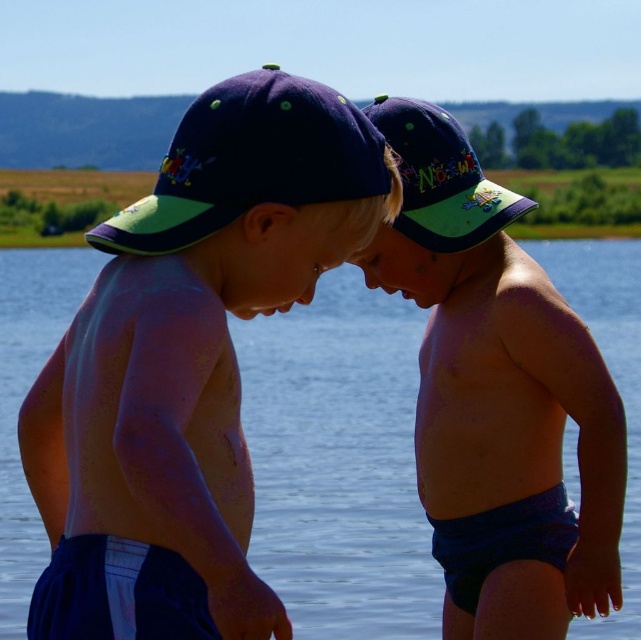
You are a photographer trying to capture the children in the scene. You need to ensure that both the transparent blue water at center and the matte blue shorts at center are visible in your shot. Given their sizes, which object should you focus on to include both in the frame?

Since the transparent blue water at center is larger than the matte blue shorts at center, you should focus on the transparent blue water at center to ensure both objects fit within the frame.

Looking at this image, you are a lifeguard on duty at the lake. You notice two children near the water. One has matte blue shorts at center and the other is near transparent blue water at center. Which child is closer to the water?

The child with matte blue shorts at center is closer to the transparent blue water at center because the water is below the shorts, indicating proximity.